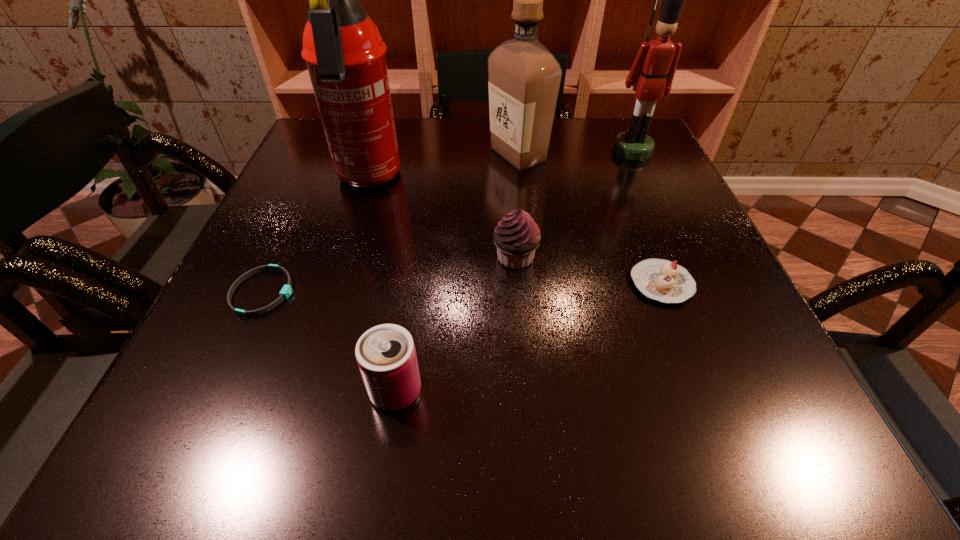
Where is `liquor located at the far edge`? The height and width of the screenshot is (540, 960). liquor located at the far edge is located at coordinates (524, 77).

Where is `object at the near edge`? This screenshot has height=540, width=960. object at the near edge is located at coordinates (386, 356).

Locate an element on the screen. fire extinguisher present at the left edge is located at coordinates (345, 55).

Image resolution: width=960 pixels, height=540 pixels. Identify the location of wristband located in the left edge section of the desktop. (286, 291).

This screenshot has height=540, width=960. Find the location of `nutcracker located at the right edge`. nutcracker located at the right edge is located at coordinates (651, 75).

This screenshot has height=540, width=960. Find the location of `cupcake located at the right edge`. cupcake located at the right edge is located at coordinates (662, 280).

Locate an element on the screen. This screenshot has height=540, width=960. object situated at the far left corner is located at coordinates (345, 55).

Where is `object at the far right corner`? The image size is (960, 540). object at the far right corner is located at coordinates (651, 75).

I want to click on free point at the far edge, so click(399, 118).

This screenshot has width=960, height=540. In the image, there is a desktop. Find the location of `vacant area at the near edge`. vacant area at the near edge is located at coordinates (338, 444).